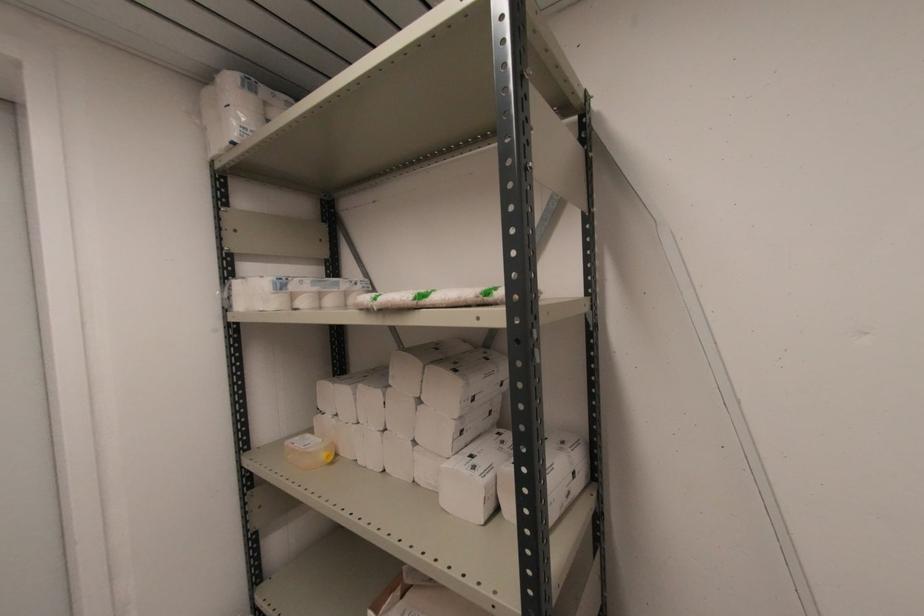
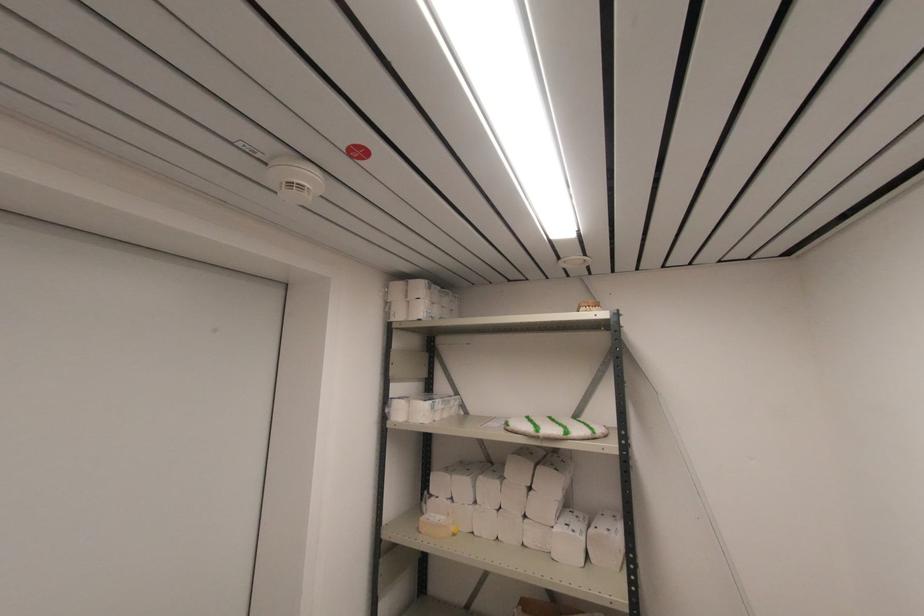
Where in the second image is the point corresponding to pixel 371 305 from the first image?

(537, 436)